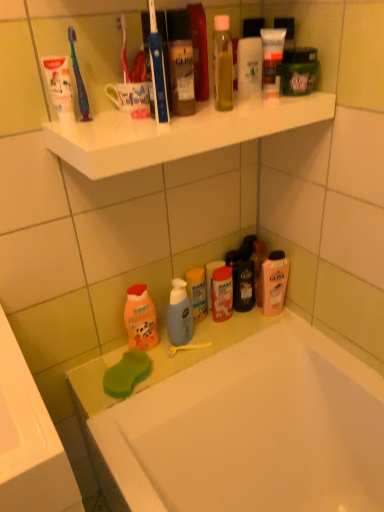
Where is `vacant area to the right of orange matte bottle at lower left`? vacant area to the right of orange matte bottle at lower left is located at coordinates (196, 345).